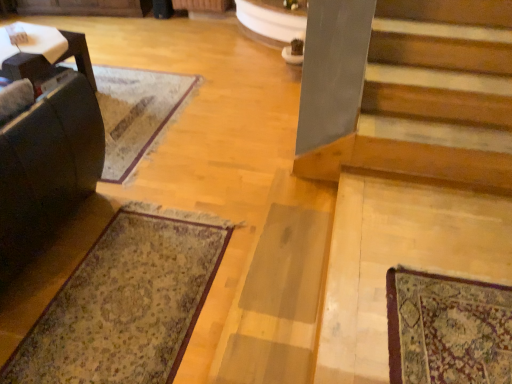
Question: Is dark brown leather rocking chair at left further to camera compared to patterned carpet at lower left?

Choices:
 (A) no
 (B) yes

Answer: (A)

Question: Is dark brown leather rocking chair at left outside of patterned carpet at lower left?

Choices:
 (A) yes
 (B) no

Answer: (A)

Question: From a real-world perspective, is dark brown leather rocking chair at left beneath patterned carpet at lower left?

Choices:
 (A) no
 (B) yes

Answer: (A)

Question: From the image's perspective, is dark brown leather rocking chair at left on top of patterned carpet at lower left?

Choices:
 (A) no
 (B) yes

Answer: (B)

Question: Is dark brown leather rocking chair at left facing towards patterned carpet at lower left?

Choices:
 (A) yes
 (B) no

Answer: (B)

Question: From a real-world perspective, is patterned carpet at lower left positioned above or below wooden stairs at lower right?

Choices:
 (A) above
 (B) below

Answer: (B)

Question: Is patterned carpet at lower left inside the boundaries of wooden stairs at lower right, or outside?

Choices:
 (A) outside
 (B) inside

Answer: (A)

Question: Considering the positions of patterned carpet at lower left and wooden stairs at lower right in the image, is patterned carpet at lower left wider or thinner than wooden stairs at lower right?

Choices:
 (A) thin
 (B) wide

Answer: (A)

Question: Does point (51, 367) appear closer or farther from the camera than point (436, 24)?

Choices:
 (A) closer
 (B) farther

Answer: (A)

Question: Is patterned carpet at lower left to the left or to the right of dark brown leather rocking chair at left in the image?

Choices:
 (A) right
 (B) left

Answer: (A)

Question: From the image's perspective, relative to dark brown leather rocking chair at left, is patterned carpet at lower left above or below?

Choices:
 (A) below
 (B) above

Answer: (A)

Question: From a real-world perspective, is patterned carpet at lower left positioned above or below dark brown leather rocking chair at left?

Choices:
 (A) above
 (B) below

Answer: (B)

Question: In the image, is patterned carpet at lower left positioned in front of or behind dark brown leather rocking chair at left?

Choices:
 (A) front
 (B) behind

Answer: (B)

Question: From the image's perspective, is wooden stairs at lower right above or below patterned carpet at lower left?

Choices:
 (A) above
 (B) below

Answer: (A)

Question: Is wooden stairs at lower right wider or thinner than patterned carpet at lower left?

Choices:
 (A) thin
 (B) wide

Answer: (B)